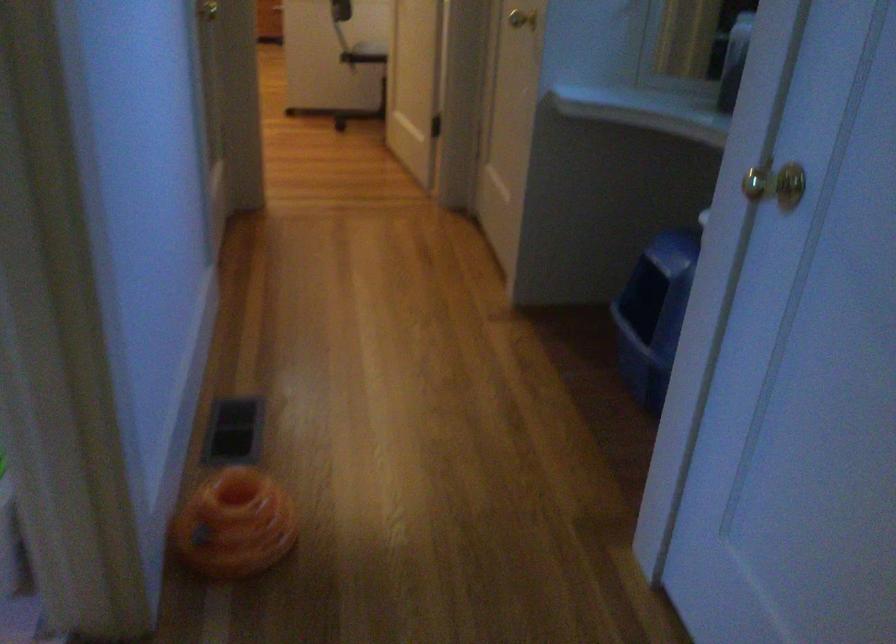
Where is `chair armrest`? The image size is (896, 644). chair armrest is located at coordinates (340, 10).